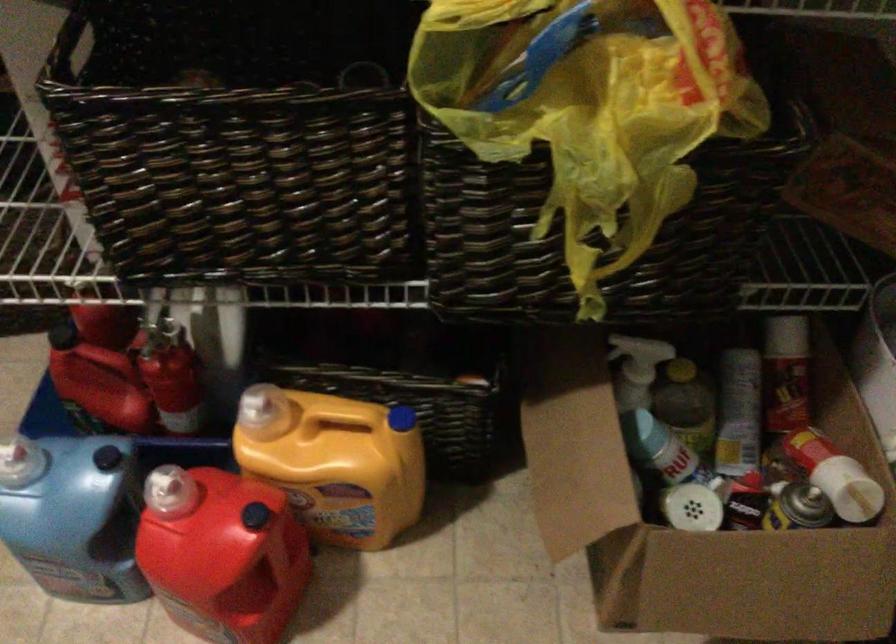
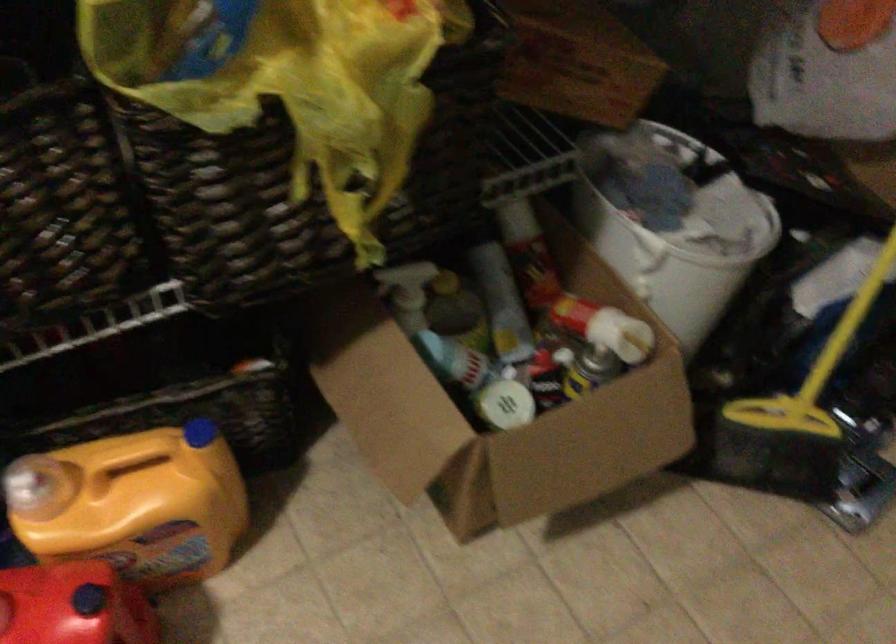
Question: I am providing you with two images of the same scene from different viewpoints. After the viewpoint changes to image2, which objects are now occluded?

Choices:
 (A) yellow plastic bag
 (B) white jar lid
 (C) cardboard box
 (D) none of these

Answer: (D)